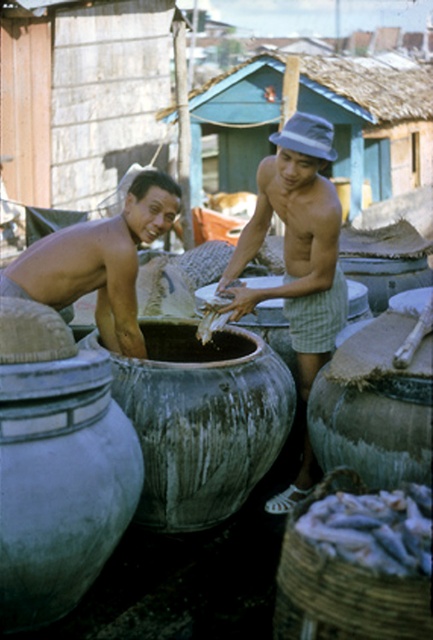
Does matte gray hat at center come in front of silvery fish at lower right?

No.

Between matte gray hat at center and silvery fish at lower right, which one is positioned lower?

silvery fish at lower right is below.

Between point (299, 340) and point (400, 531), which one is positioned in front?

Point (400, 531)

At what (x,y) coordinates should I click in order to perform the action: click on matte gray hat at center. Please return your answer as a coordinate pair (x, y). Looking at the image, I should click on (297, 243).

Does point (286, 128) come closer to viewer compared to point (145, 193)?

No, it is not.

Based on the photo, is matte gray hat at center positioned behind smooth skin torso at left?

That is True.

Between point (300, 253) and point (138, 189), which one is positioned behind?

Positioned behind is point (300, 253).

Identify the location of matte gray hat at center. This screenshot has width=433, height=640. (297, 243).

Who is positioned more to the right, silvery fish at lower right or smooth white rice at center?

Positioned to the right is silvery fish at lower right.

This screenshot has width=433, height=640. I want to click on silvery fish at lower right, so click(x=374, y=529).

The height and width of the screenshot is (640, 433). Identify the location of silvery fish at lower right. (374, 529).